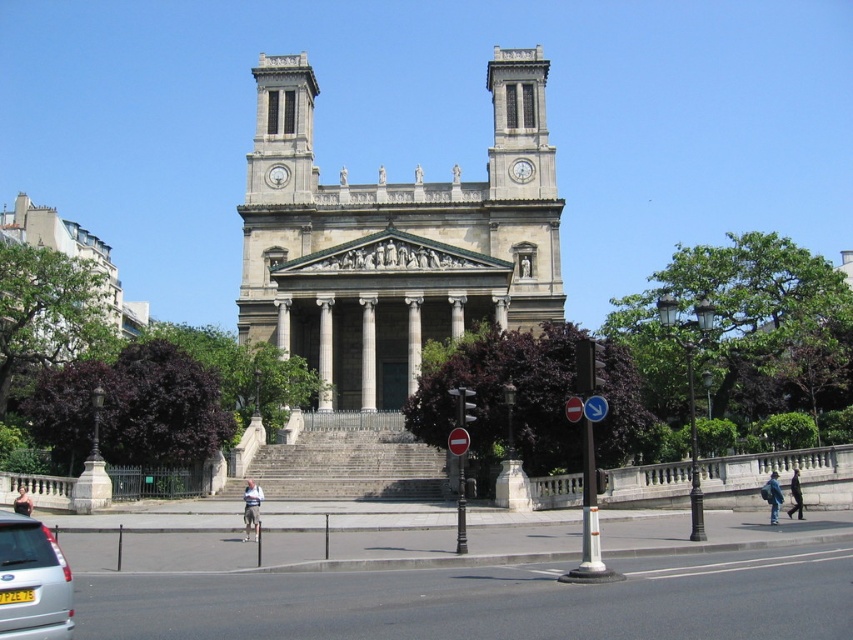
Question: Is white stone church at center to the left of white marble column at center from the viewer's perspective?

Choices:
 (A) yes
 (B) no

Answer: (B)

Question: Which object is the closest to the silver metallic car at lower left?

Choices:
 (A) white stone church at center
 (B) white glossy clock at upper center

Answer: (A)

Question: Which object appears closest to the camera in this image?

Choices:
 (A) white glossy clock at upper center
 (B) white stone church at center
 (C) silver metallic car at lower left
 (D) white marble column at center

Answer: (C)

Question: In this image, where is white stone church at center located relative to white marble column at center?

Choices:
 (A) left
 (B) right

Answer: (B)

Question: Can you confirm if white stone church at center is positioned to the right of white marble column at center?

Choices:
 (A) yes
 (B) no

Answer: (A)

Question: Which point is farther to the camera?

Choices:
 (A) silver metallic car at lower left
 (B) white glossy clock at upper center
 (C) white marble column at center
 (D) white stone church at center

Answer: (B)